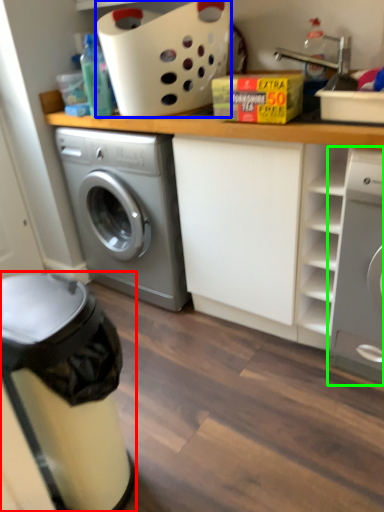
Question: Which is farther away from dish washer (highlighted by a red box)? basket (highlighted by a blue box) or washing machine (highlighted by a green box)?

Choices:
 (A) basket
 (B) washing machine

Answer: (A)